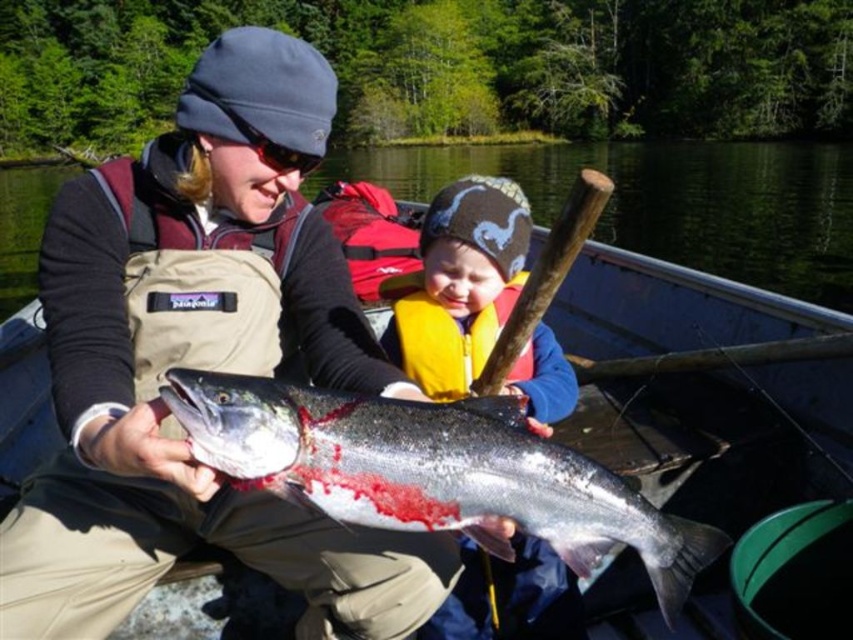
You are a fisherman who just caught a shiny silver fish at center. You want to place a GPS tracker on the fish to monitor its movement. The tracker must be placed at point (432, 472). Where on the fish should you place the tracker?

The point (432, 472) is on the shiny silver fish at center, so you should place the tracker on the shiny silver fish at center.

You are standing on the shore of the lake and see two points marked on the boat. Which point is closer to you, point (386, 456) or point (491, 326)?

Point (386, 456) is closer to the viewer than point (491, 326).